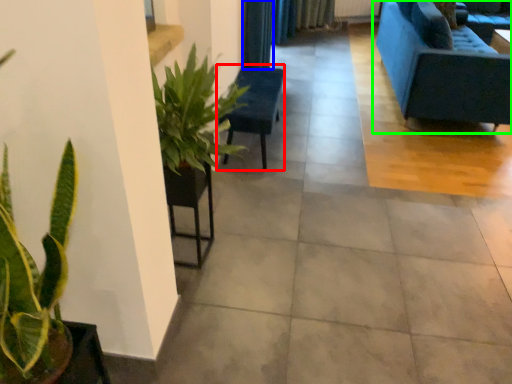
Question: Which object is the closest to the armchair (highlighted by a red box)? Choose among these: curtain (highlighted by a blue box) or studio couch (highlighted by a green box).

Choices:
 (A) curtain
 (B) studio couch

Answer: (A)